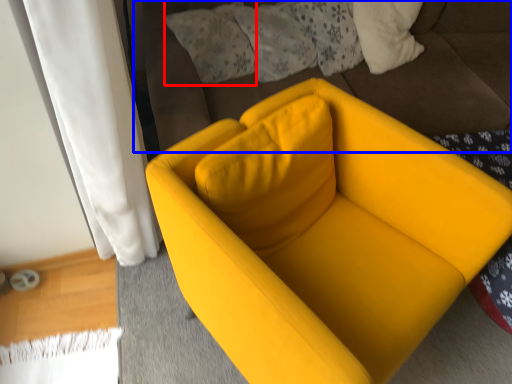
Question: Which point is closer to the camera, pillow (highlighted by a red box) or bedding (highlighted by a blue box)?

Choices:
 (A) pillow
 (B) bedding

Answer: (B)